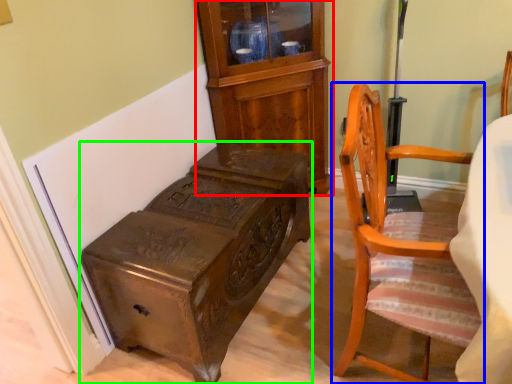
Question: Based on their relative distances, which object is farther from cabinetry (highlighted by a red box)? Choose from chair (highlighted by a blue box) and furniture (highlighted by a green box).

Choices:
 (A) chair
 (B) furniture

Answer: (A)